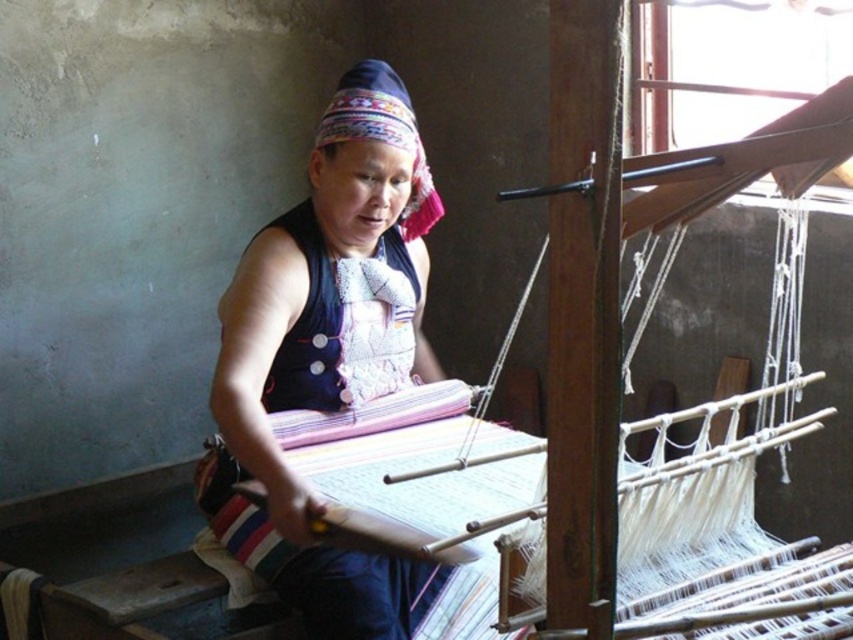
You are a weaver who needs to place a new thread spool on the blue fabric apron at center. Based on the coordinates provided, where exactly should you place the spool on the apron?

The blue fabric apron at center is located at point (344, 323), so you should place the new thread spool at those coordinates on the apron.

You are a weaver who wants to create a new scarf using the same materials as the ones in the scene. You have a piece of matte black fabric at center and an embroidered fabric headscarf at center. If you want to make a scarf that is wider than the headscarf, which material should you choose?

The matte black fabric at center has a larger width than the embroidered fabric headscarf at center, so you should choose the matte black fabric at center to make a wider scarf.

You are a weaver who wants to know which item has a greater width between the blue fabric apron at center and the embroidered fabric headscarf at center. Which one is wider?

The blue fabric apron at center is wider than the embroidered fabric headscarf at center.